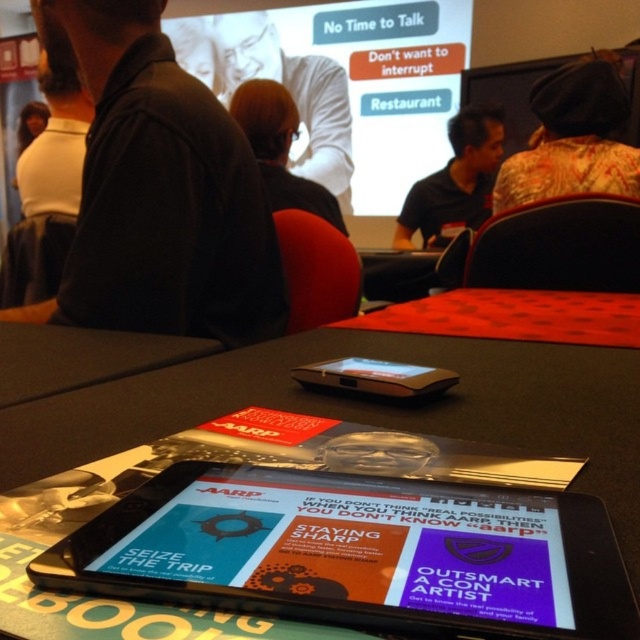
Question: Considering the relative positions of white shirt at upper left and blonde hair at center in the image provided, where is white shirt at upper left located with respect to blonde hair at center?

Choices:
 (A) below
 (B) above

Answer: (B)

Question: Which point is closer to the camera?

Choices:
 (A) black plastic tablet at center
 (B) white shirt at upper left
 (C) dark gray shirt at upper left
 (D) matte black shirt at center

Answer: (A)

Question: Which object appears farthest from the camera in this image?

Choices:
 (A) floral fabric shirt at upper right
 (B) dark gray shirt at upper left

Answer: (A)

Question: Does floral fabric shirt at upper right have a smaller size compared to black plastic tablet at center?

Choices:
 (A) no
 (B) yes

Answer: (A)

Question: Which object is farther from the camera taking this photo?

Choices:
 (A) dark gray shirt at upper left
 (B) floral fabric shirt at upper right
 (C) matte black shirt at center
 (D) black plastic tablet at center

Answer: (C)

Question: Does floral fabric shirt at upper right appear under matte black shirt at center?

Choices:
 (A) yes
 (B) no

Answer: (A)